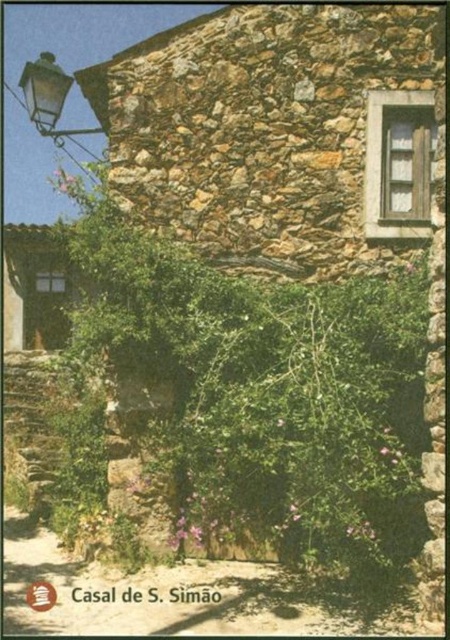
Question: Which point is farther from the camera taking this photo?

Choices:
 (A) (66, 97)
 (B) (428, 220)
 (C) (322, 404)

Answer: (A)

Question: Can you confirm if wooden window at upper right is positioned above matte black lantern at upper left?

Choices:
 (A) yes
 (B) no

Answer: (B)

Question: Among these objects, which one is nearest to the camera?

Choices:
 (A) matte black lantern at upper left
 (B) wooden window at upper right

Answer: (A)

Question: Is green leafy ivy at center above matte black lantern at upper left?

Choices:
 (A) no
 (B) yes

Answer: (A)

Question: Which of the following is the closest to the observer?

Choices:
 (A) (35, 104)
 (B) (145, 326)

Answer: (B)

Question: Where is green leafy ivy at center located in relation to matte black lantern at upper left in the image?

Choices:
 (A) right
 (B) left

Answer: (A)